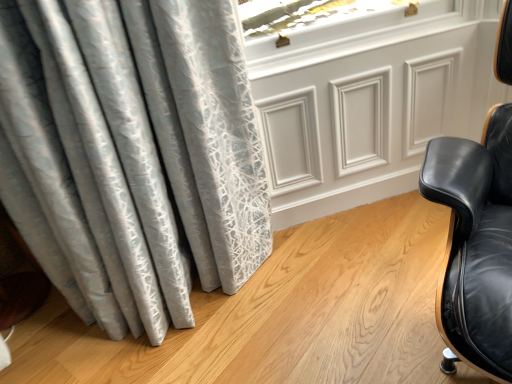
Question: Does black leather chair at right have a larger size compared to white glossy panel at upper center?

Choices:
 (A) yes
 (B) no

Answer: (A)

Question: Is black leather chair at right smaller than white glossy panel at upper center?

Choices:
 (A) yes
 (B) no

Answer: (B)

Question: Is black leather chair at right behind white glossy panel at upper center?

Choices:
 (A) no
 (B) yes

Answer: (A)

Question: Is black leather chair at right oriented towards white glossy panel at upper center?

Choices:
 (A) yes
 (B) no

Answer: (B)

Question: Can you confirm if black leather chair at right is shorter than white glossy panel at upper center?

Choices:
 (A) no
 (B) yes

Answer: (A)

Question: Is black leather chair at right positioned beyond the bounds of white glossy panel at upper center?

Choices:
 (A) yes
 (B) no

Answer: (A)

Question: Is white glossy panel at upper center at the right side of black leather chair at right?

Choices:
 (A) yes
 (B) no

Answer: (B)

Question: Considering the relative sizes of white glossy panel at upper center and black leather chair at right in the image provided, is white glossy panel at upper center bigger than black leather chair at right?

Choices:
 (A) yes
 (B) no

Answer: (B)

Question: Is white glossy panel at upper center further to the viewer compared to black leather chair at right?

Choices:
 (A) yes
 (B) no

Answer: (A)

Question: Is there a large distance between white glossy panel at upper center and black leather chair at right?

Choices:
 (A) no
 (B) yes

Answer: (A)

Question: Is white glossy panel at upper center positioned in front of black leather chair at right?

Choices:
 (A) no
 (B) yes

Answer: (A)

Question: Is white glossy panel at upper center facing towards black leather chair at right?

Choices:
 (A) no
 (B) yes

Answer: (B)

Question: From the image's perspective, is white glossy panel at upper center above or below black leather chair at right?

Choices:
 (A) below
 (B) above

Answer: (B)